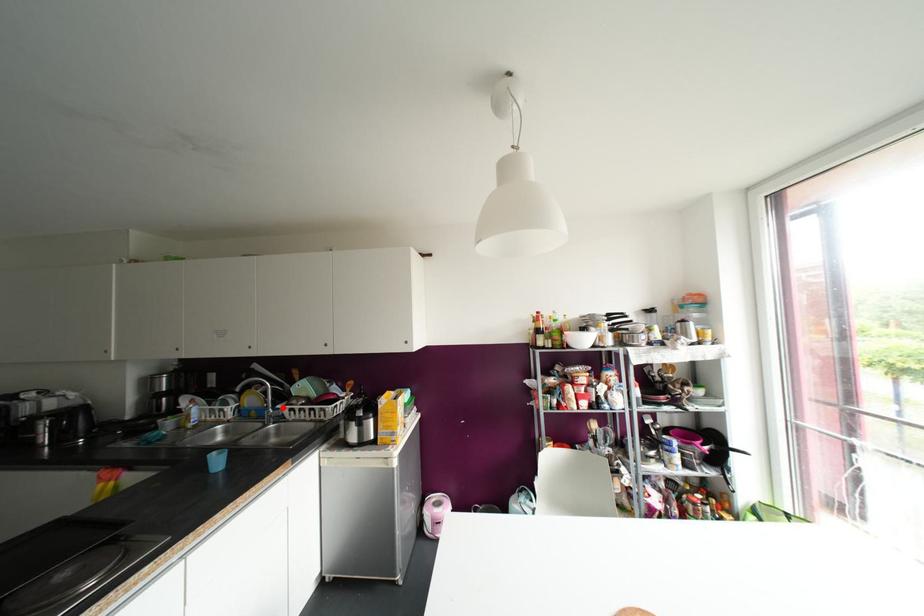
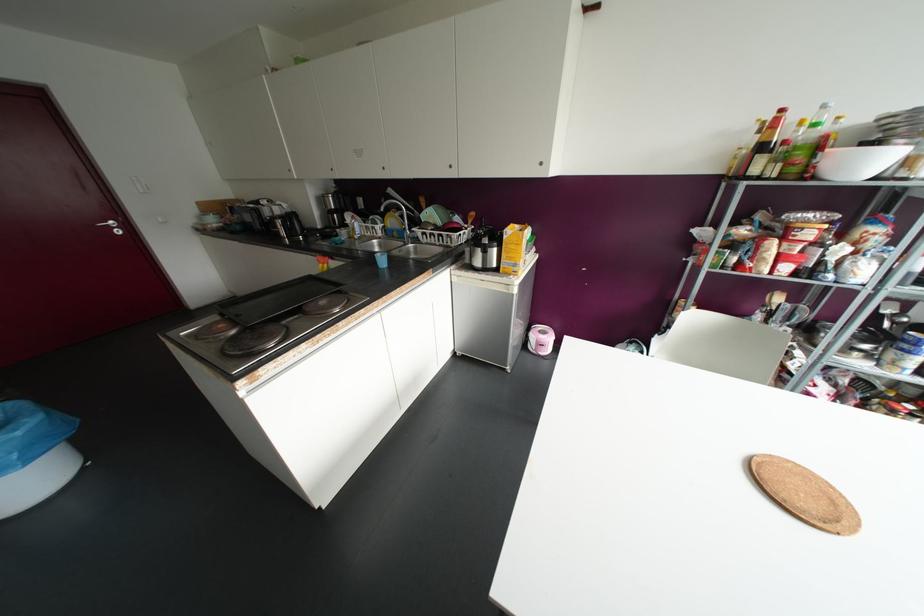
Question: I am providing you with two images of the same scene from different viewpoints. Given a red point in image1, look at the same physical point in image2. Is it:

Choices:
 (A) Closer to the viewpoint
 (B) Farther from the viewpoint

Answer: (A)